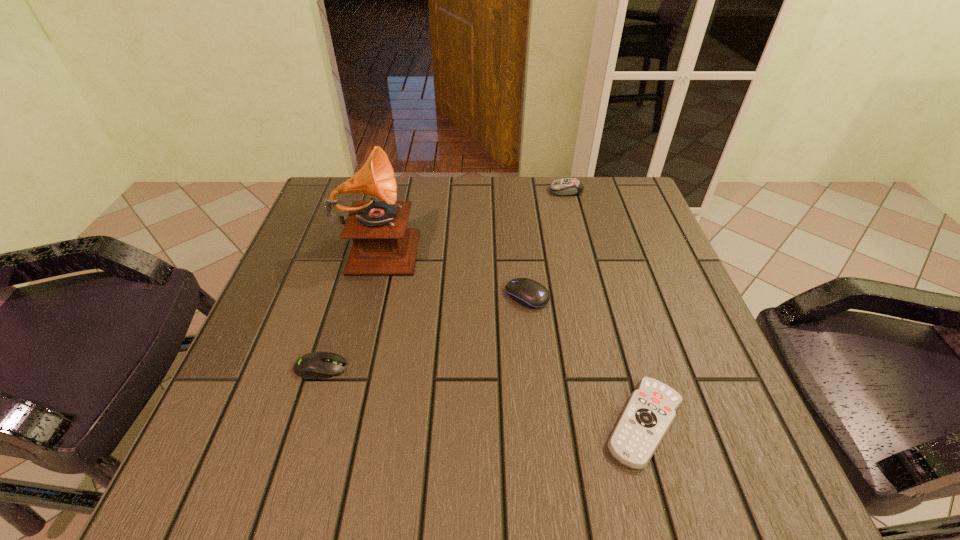
Locate an element on the screen. vacant space located 0.100m on the horn of the second farthest object is located at coordinates (461, 245).

The width and height of the screenshot is (960, 540). I want to click on vacant space located on the wheel side of the farthest computer mouse, so click(447, 191).

Identify the location of free region located 0.230m on the wheel side of the farthest computer mouse. (466, 191).

This screenshot has width=960, height=540. Find the location of `free space located 0.170m on the wheel side of the farthest computer mouse`. free space located 0.170m on the wheel side of the farthest computer mouse is located at coordinates (488, 191).

Where is `vacant space situated on the back of the third nearest object`? The width and height of the screenshot is (960, 540). vacant space situated on the back of the third nearest object is located at coordinates (523, 260).

The height and width of the screenshot is (540, 960). Identify the location of free spot located 0.180m on the wheel side of the fourth tallest object. (446, 368).

Where is `vacant area situated 0.110m on the back of the remote control`? vacant area situated 0.110m on the back of the remote control is located at coordinates (618, 332).

At what (x,y) coordinates should I click in order to perform the action: click on phonograph record at the far edge. Please return your answer as a coordinate pair (x, y). Looking at the image, I should click on (382, 245).

Image resolution: width=960 pixels, height=540 pixels. I want to click on computer mouse located at the far edge, so click(x=567, y=186).

What are the coordinates of `object at the near edge` in the screenshot? It's located at click(x=650, y=411).